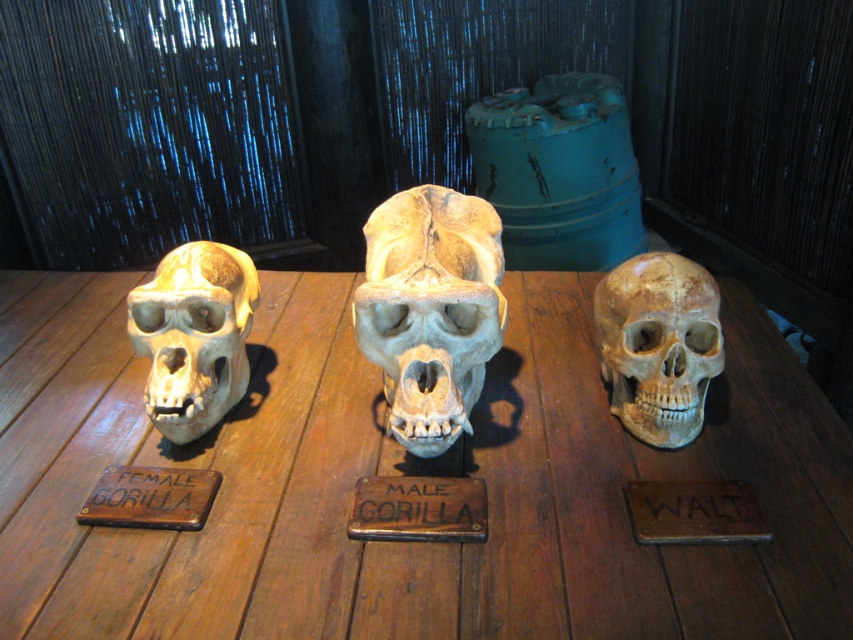
Which is below, matte beige skull at left or brown wood sign at center?

brown wood sign at center is below.

Which of these two, matte beige skull at left or brown wood sign at center, stands shorter?

brown wood sign at center

The width and height of the screenshot is (853, 640). What are the coordinates of `matte beige skull at left` in the screenshot? It's located at (194, 336).

Is matte beige skull at center above wooden sign at center?

Correct, matte beige skull at center is located above wooden sign at center.

From the picture: Measure the distance from matte beige skull at center to wooden sign at center.

27.97 inches

Identify the location of matte beige skull at center. This screenshot has height=640, width=853. (659, 344).

Can you confirm if matte bone skull at center is positioned to the right of wooden sign at center?

Indeed, matte bone skull at center is positioned on the right side of wooden sign at center.

Does matte bone skull at center appear under wooden sign at center?

No.

Which is behind, point (474, 228) or point (363, 477)?

The point (474, 228) is more distant.

Locate an element on the screen. The width and height of the screenshot is (853, 640). matte bone skull at center is located at coordinates (430, 308).